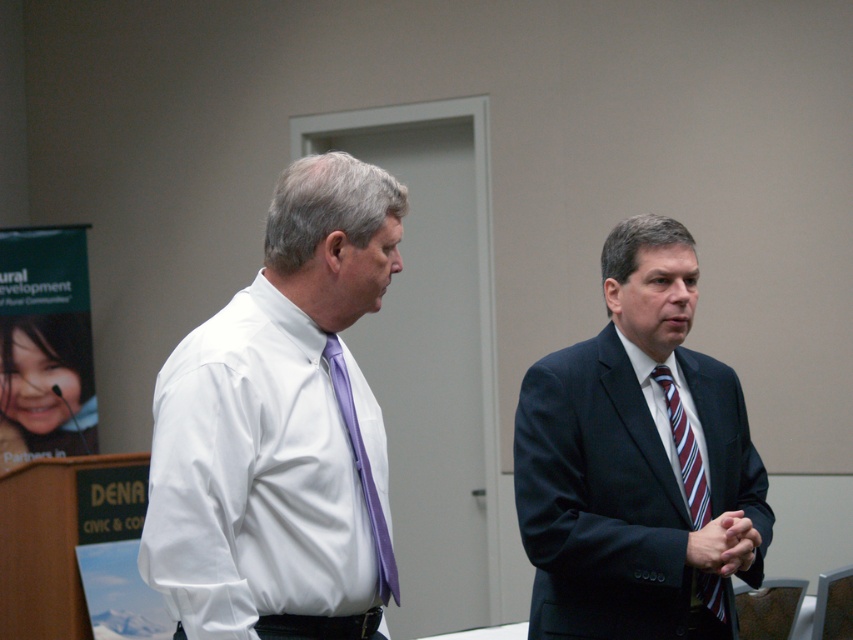
Does dark blue suit at right lie in front of purple silk tie at center?

That is False.

Does point (589, 353) come farther from viewer compared to point (323, 348)?

Yes, point (589, 353) is farther from viewer.

Is point (531, 470) behind point (332, 348)?

Yes, it is.

You are a GUI agent. You are given a task and a screenshot of the screen. Output one action in this format:
    pyautogui.click(x=<x>, y=<y>)
    Task: Click on the dark blue suit at right
    Image resolution: width=853 pixels, height=640 pixels.
    Given the screenshot: What is the action you would take?
    pyautogui.click(x=637, y=461)

Does white smooth shirt at left have a larger size compared to dark blue suit at right?

Actually, white smooth shirt at left might be smaller than dark blue suit at right.

Looking at this image, between white smooth shirt at left and dark blue suit at right, which one has less height?

white smooth shirt at left

Between point (326, 536) and point (575, 461), which one is positioned behind?

The point (575, 461) is more distant.

This screenshot has height=640, width=853. In order to click on white smooth shirt at left in this screenshot , I will do `click(280, 424)`.

How distant is white smooth shirt at left from striped fabric tie at center?

white smooth shirt at left is 3.56 feet away from striped fabric tie at center.

Can you confirm if white smooth shirt at left is shorter than striped fabric tie at center?

No.

Measure the distance between point (334,532) and camera.

A distance of 2.20 meters exists between point (334,532) and camera.

Where is `white smooth shirt at left`? The height and width of the screenshot is (640, 853). white smooth shirt at left is located at coordinates (280, 424).